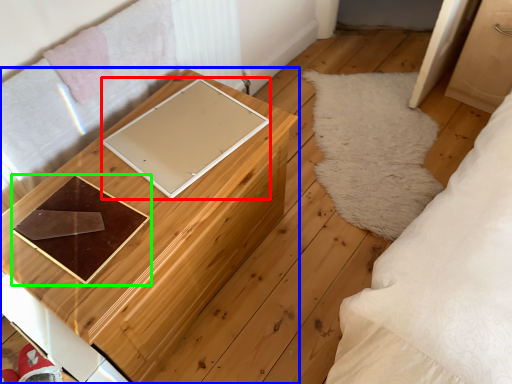
Question: Which object is the farthest from pad (highlighted by a red box)? Choose among these: furniture (highlighted by a blue box) or tray (highlighted by a green box).

Choices:
 (A) furniture
 (B) tray

Answer: (B)